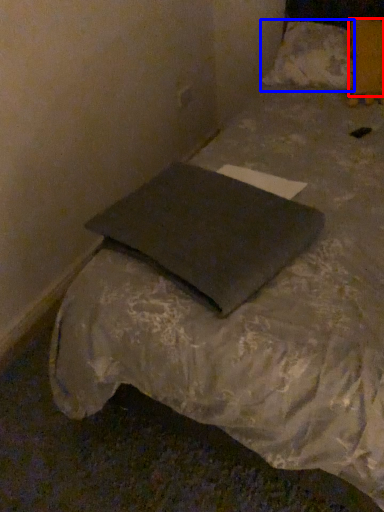
Question: Among these objects, which one is nearest to the camera, pillow (highlighted by a red box) or pillow (highlighted by a blue box)?

Choices:
 (A) pillow
 (B) pillow

Answer: (A)